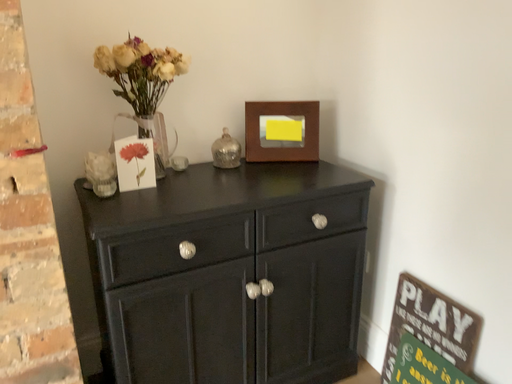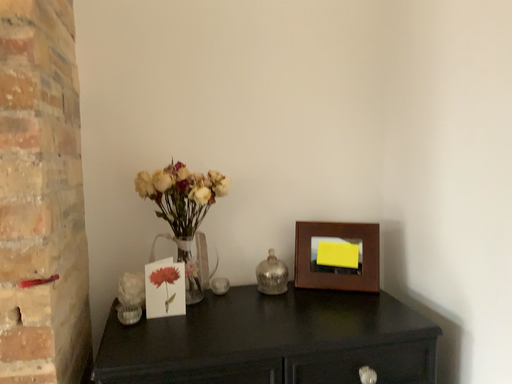
Question: Which way did the camera rotate in the video?

Choices:
 (A) rotated right
 (B) rotated left

Answer: (B)